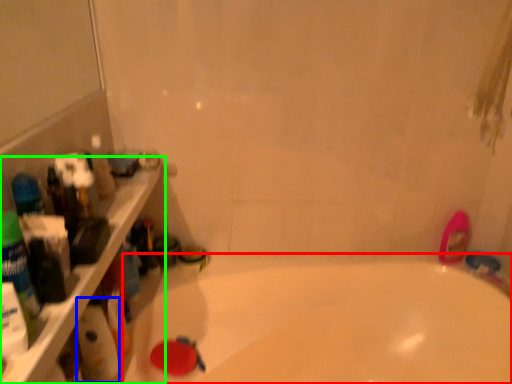
Question: Which object is the farthest from bathtub (highlighted by a red box)? Choose among these: cleaning product (highlighted by a blue box) or ledge (highlighted by a green box).

Choices:
 (A) cleaning product
 (B) ledge

Answer: (B)